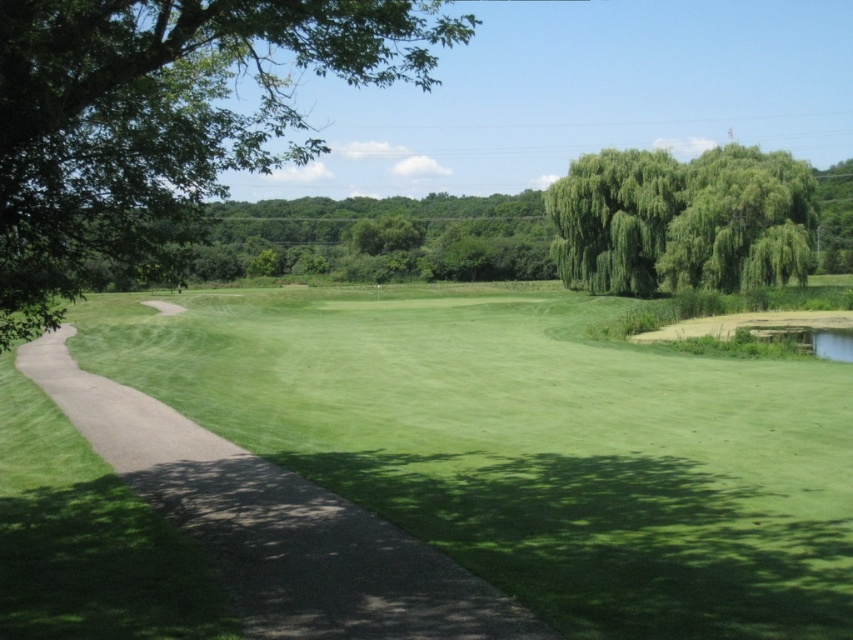
Question: Estimate the real-world distances between objects in this image. Which object is closer to the green leafy tree at upper center?

Choices:
 (A) green leafy tree at upper right
 (B) green leafy tree at left

Answer: (A)

Question: Is green leafy tree at left closer to the viewer compared to green leafy tree at upper right?

Choices:
 (A) yes
 (B) no

Answer: (A)

Question: Among these objects, which one is farthest from the camera?

Choices:
 (A) green leafy tree at left
 (B) gray asphalt path at left
 (C) green leafy tree at upper right

Answer: (C)

Question: Among these objects, which one is nearest to the camera?

Choices:
 (A) green leafy tree at upper center
 (B) green leafy tree at left
 (C) green leafy tree at upper right

Answer: (B)

Question: Does green leafy tree at left appear under green leafy tree at upper right?

Choices:
 (A) no
 (B) yes

Answer: (A)

Question: Is green leafy tree at upper right thinner than green leafy tree at upper center?

Choices:
 (A) yes
 (B) no

Answer: (B)